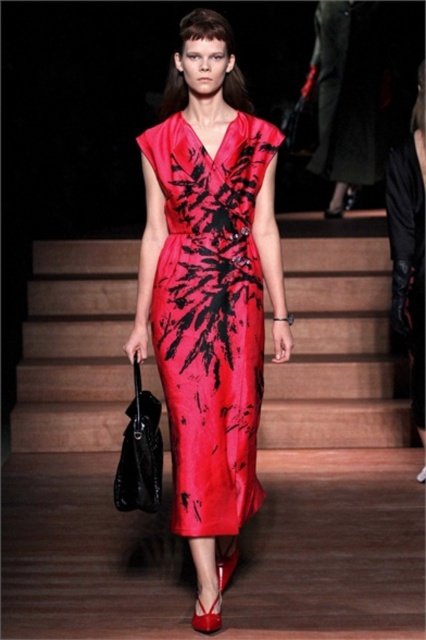
Which of these two, satin stairs at center or shiny silk dress at center, stands taller?

shiny silk dress at center is taller.

Who is lower down, satin stairs at center or shiny silk dress at center?

satin stairs at center is below.

You are a GUI agent. You are given a task and a screenshot of the screen. Output one action in this format:
    pyautogui.click(x=<x>, y=<y>)
    Task: Click on the satin stairs at center
    The image size is (426, 640).
    Given the screenshot: What is the action you would take?
    pyautogui.click(x=333, y=454)

The image size is (426, 640). What are the coordinates of `satin stairs at center` in the screenshot? It's located at (333, 454).

In the scene shown: Who is taller, shiny silk dress at center or silky black dress at right?

Standing taller between the two is silky black dress at right.

In the scene shown: Does shiny silk dress at center appear over silky black dress at right?

Incorrect, shiny silk dress at center is not positioned above silky black dress at right.

Which is behind, point (193, 381) or point (400, 332)?

Point (400, 332)

This screenshot has height=640, width=426. In order to click on shiny silk dress at center in this screenshot , I will do `click(210, 317)`.

Between satin stairs at center and silky black dress at right, which one appears on the left side from the viewer's perspective?

From the viewer's perspective, satin stairs at center appears more on the left side.

Is satin stairs at center thinner than silky black dress at right?

No.

Between point (397, 433) and point (420, 388), which one is positioned in front?

Point (420, 388) is more forward.

This screenshot has width=426, height=640. What are the coordinates of `satin stairs at center` in the screenshot? It's located at (333, 454).